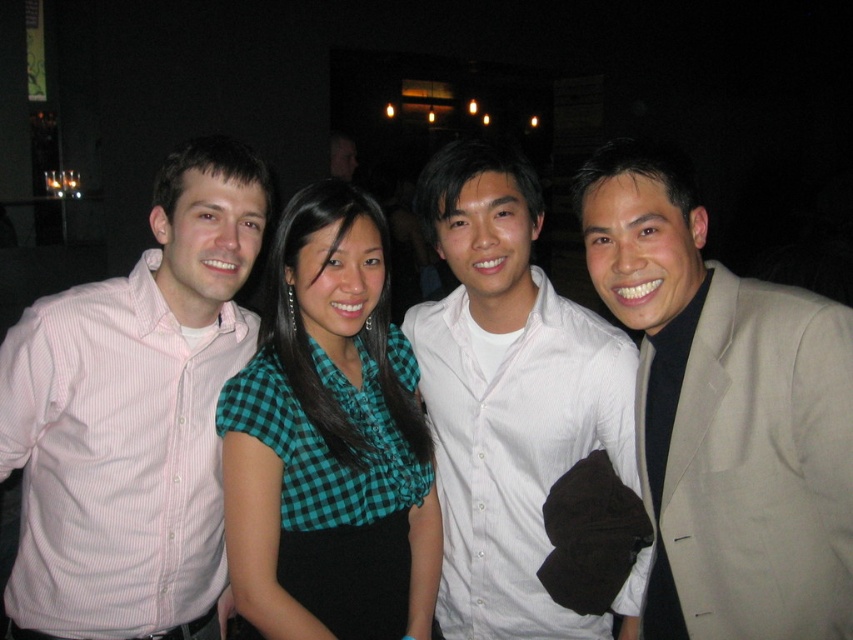
Measure the distance from green checkered blouse at center to white textured shirt at center.

The distance of green checkered blouse at center from white textured shirt at center is 9.18 inches.

Where is `green checkered blouse at center`? The width and height of the screenshot is (853, 640). green checkered blouse at center is located at coordinates (329, 442).

Where is `green checkered blouse at center`? This screenshot has height=640, width=853. green checkered blouse at center is located at coordinates (329, 442).

Is tan fabric suit at right positioned at the back of green checkered blouse at center?

No, tan fabric suit at right is in front of green checkered blouse at center.

Can you confirm if tan fabric suit at right is positioned below green checkered blouse at center?

Incorrect, tan fabric suit at right is not positioned below green checkered blouse at center.

The height and width of the screenshot is (640, 853). What do you see at coordinates (724, 413) in the screenshot? I see `tan fabric suit at right` at bounding box center [724, 413].

This screenshot has width=853, height=640. I want to click on tan fabric suit at right, so click(x=724, y=413).

Which is behind, point (143, 580) or point (264, 529)?

Positioned behind is point (143, 580).

Is pink striped shirt at left thinner than green checkered blouse at center?

No.

Does point (103, 401) come farther from viewer compared to point (329, 592)?

Yes, point (103, 401) is behind point (329, 592).

The image size is (853, 640). In order to click on pink striped shirt at left in this screenshot , I will do `click(132, 417)`.